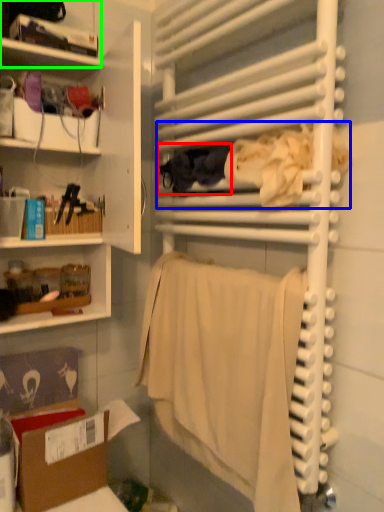
Question: Which is nearer to the clothing (highlighted by a red box)? clothing (highlighted by a blue box) or shelf (highlighted by a green box).

Choices:
 (A) clothing
 (B) shelf

Answer: (A)